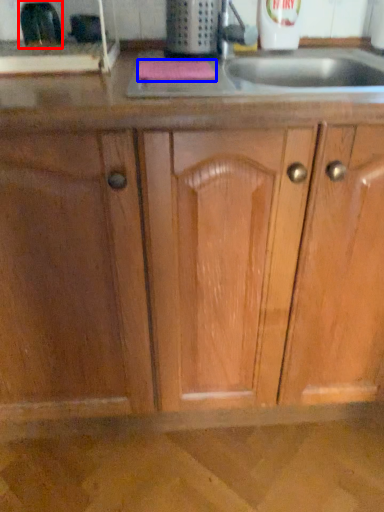
Question: Which object appears farthest to the camera in this image, appliance (highlighted by a red box) or soap (highlighted by a blue box)?

Choices:
 (A) appliance
 (B) soap

Answer: (A)